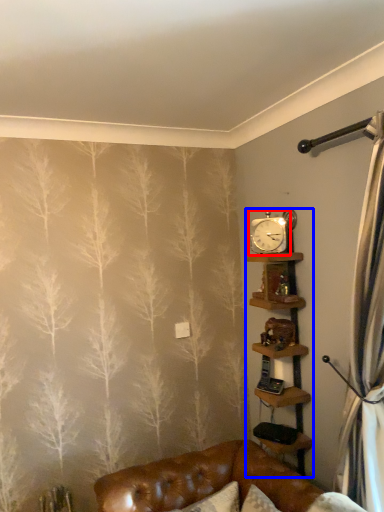
Question: Which object is further to the camera taking this photo, clock (highlighted by a red box) or shelf (highlighted by a blue box)?

Choices:
 (A) clock
 (B) shelf

Answer: (A)